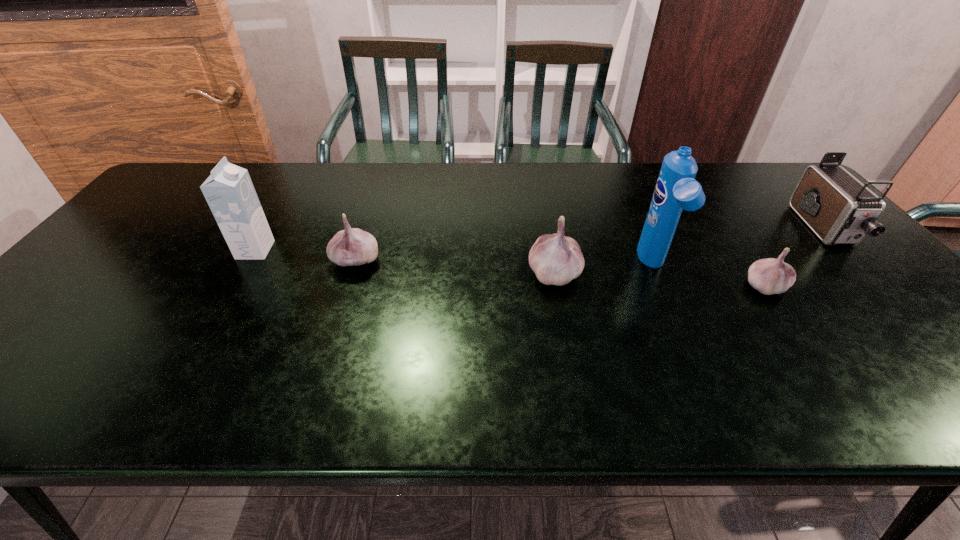
Point out which object is positioned as the fifth nearest to the second garlic from right to left. Please provide its 2D coordinates. Your answer should be formatted as a tuple, i.e. [(x, y)], where the tuple contains the x and y coordinates of a point satisfying the conditions above.

[(229, 191)]

Where is `object that is the nearest to the second tallest object`? This screenshot has width=960, height=540. object that is the nearest to the second tallest object is located at coordinates (352, 246).

Select which garlic appears as the closest to the second garlic from left to right. Please provide its 2D coordinates. Your answer should be formatted as a tuple, i.e. [(x, y)], where the tuple contains the x and y coordinates of a point satisfying the conditions above.

[(352, 246)]

Identify which garlic is located as the second nearest to the shortest object. Please provide its 2D coordinates. Your answer should be formatted as a tuple, i.e. [(x, y)], where the tuple contains the x and y coordinates of a point satisfying the conditions above.

[(352, 246)]

At what (x,y) coordinates should I click in order to perform the action: click on vacant space that satisfies the following two spatial constraints: 1. on the front label of the fifth shortest object; 2. on the left side of the fifth tallest object. Please return your answer as a coordinate pair (x, y). The image size is (960, 540). Looking at the image, I should click on (250, 260).

Where is `blank area in the image that satisfies the following two spatial constraints: 1. on the front label of the second shortest garlic; 2. on the left side of the carton`? The height and width of the screenshot is (540, 960). blank area in the image that satisfies the following two spatial constraints: 1. on the front label of the second shortest garlic; 2. on the left side of the carton is located at coordinates (250, 260).

Where is `vacant space that satisfies the following two spatial constraints: 1. on the front label of the third object from right to left; 2. on the right side of the leftmost object`? Image resolution: width=960 pixels, height=540 pixels. vacant space that satisfies the following two spatial constraints: 1. on the front label of the third object from right to left; 2. on the right side of the leftmost object is located at coordinates (246, 267).

In order to click on free location that satisfies the following two spatial constraints: 1. on the front label of the third object from right to left; 2. on the right side of the second tallest object in this screenshot , I will do `click(246, 267)`.

At what (x,y) coordinates should I click in order to perform the action: click on vacant space that satisfies the following two spatial constraints: 1. on the front side of the fifth object from left to right; 2. on the right side of the tallest object. Please return your answer as a coordinate pair (x, y). Looking at the image, I should click on (662, 286).

I want to click on vacant point that satisfies the following two spatial constraints: 1. at the lens of the rightmost object; 2. on the front label of the leftmost object, so click(x=844, y=250).